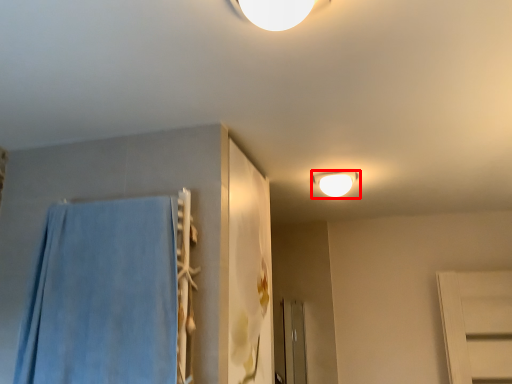
Question: Observing the image, what is the correct spatial positioning of lamp (annotated by the red box) in reference to bath towel?

Choices:
 (A) right
 (B) left

Answer: (A)